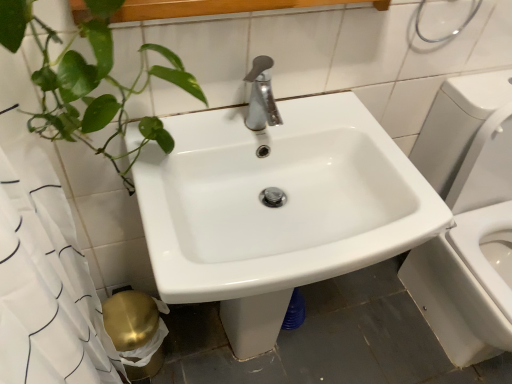
Question: From their relative heights in the image, would you say white paper at lower left is taller or shorter than white glossy sink at center?

Choices:
 (A) short
 (B) tall

Answer: (A)

Question: From a real-world perspective, is white paper at lower left physically located above or below white glossy sink at center?

Choices:
 (A) below
 (B) above

Answer: (A)

Question: In terms of width, does white paper at lower left look wider or thinner when compared to white glossy sink at center?

Choices:
 (A) wide
 (B) thin

Answer: (B)

Question: In terms of size, does white glossy sink at center appear bigger or smaller than white paper at lower left?

Choices:
 (A) big
 (B) small

Answer: (A)

Question: Is point (263, 296) positioned closer to the camera than point (151, 301)?

Choices:
 (A) closer
 (B) farther

Answer: (A)

Question: Considering the relative positions of white glossy sink at center and white paper at lower left in the image provided, is white glossy sink at center to the left or to the right of white paper at lower left?

Choices:
 (A) left
 (B) right

Answer: (B)

Question: In terms of height, does white glossy sink at center look taller or shorter compared to white paper at lower left?

Choices:
 (A) short
 (B) tall

Answer: (B)